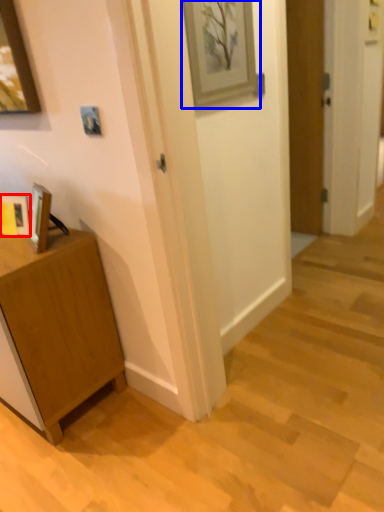
Question: Among these objects, which one is nearest to the camera, picture frame (highlighted by a red box) or picture frame (highlighted by a blue box)?

Choices:
 (A) picture frame
 (B) picture frame

Answer: (B)